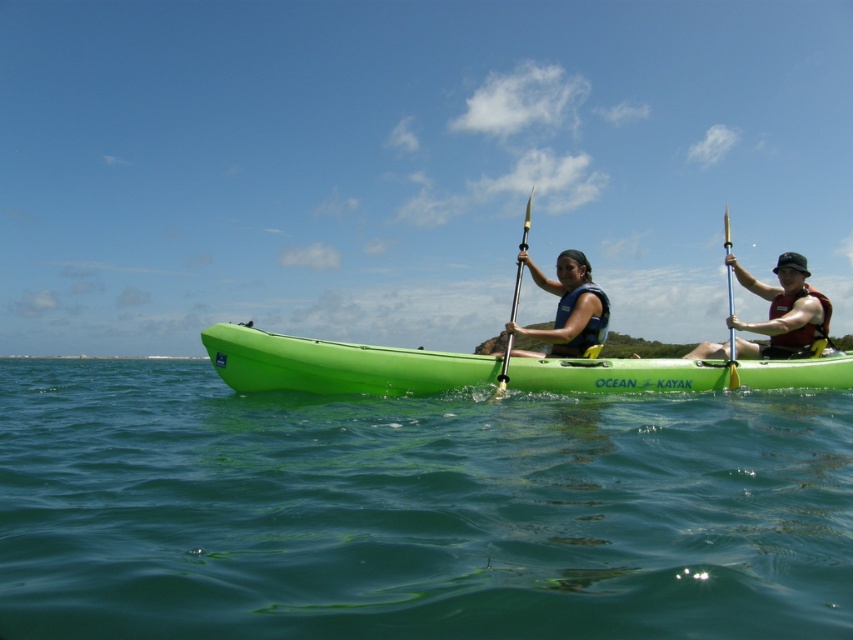
Question: In this image, where is matte red life vest at right located relative to translucent yellow paddle at right?

Choices:
 (A) above
 (B) below

Answer: (B)

Question: Is green water at center to the right of yellow metallic pole at center from the viewer's perspective?

Choices:
 (A) yes
 (B) no

Answer: (B)

Question: Which object appears farthest from the camera in this image?

Choices:
 (A) matte red life vest at right
 (B) translucent yellow paddle at right
 (C) yellow metallic pole at center
 (D) green plastic kayak at center

Answer: (A)

Question: Which is farther from the matte red life vest at right?

Choices:
 (A) green water at center
 (B) green plastic kayak at center
 (C) translucent yellow paddle at right
 (D) yellow metallic pole at center

Answer: (C)

Question: Which point appears farthest from the camera in this image?

Choices:
 (A) (729, 364)
 (B) (788, 275)

Answer: (B)

Question: In this image, where is green water at center located relative to matte blue life vest at center?

Choices:
 (A) left
 (B) right

Answer: (A)